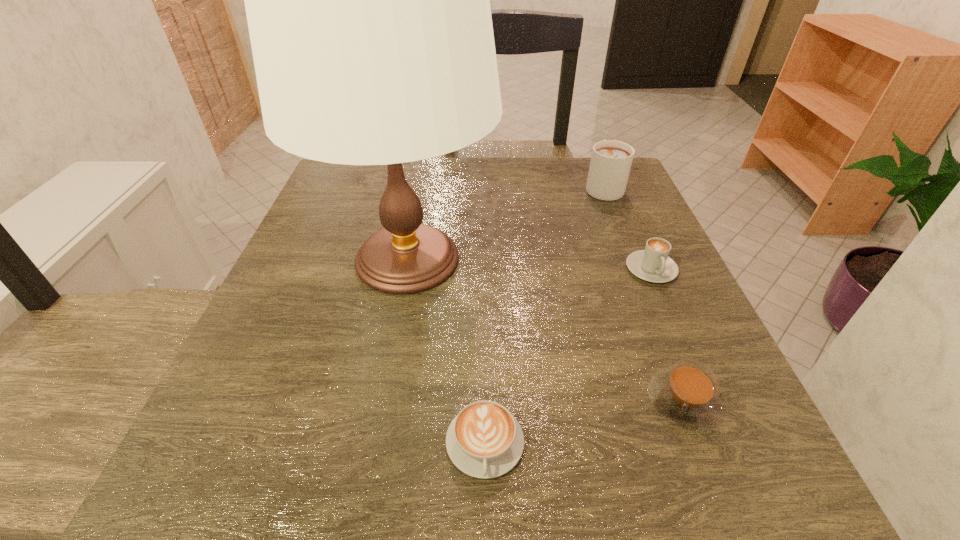
The height and width of the screenshot is (540, 960). In the image, there is a desktop. What are the coordinates of `vacant space at the far right corner` in the screenshot? It's located at (632, 184).

In the image, there is a desktop. Identify the location of free space at the near right corner. (676, 448).

You are a GUI agent. You are given a task and a screenshot of the screen. Output one action in this format:
    pyautogui.click(x=<x>, y=<y>)
    Task: Click on the vacant space in between the tallest object and the second farthest cappuccino
    This screenshot has width=960, height=540.
    Given the screenshot: What is the action you would take?
    pyautogui.click(x=529, y=264)

This screenshot has width=960, height=540. Find the location of `free space between the second farthest cappuccino and the shortest object`. free space between the second farthest cappuccino and the shortest object is located at coordinates (568, 356).

The height and width of the screenshot is (540, 960). Identify the location of free point between the fourth shortest object and the tallest object. (505, 223).

You are a GUI agent. You are given a task and a screenshot of the screen. Output one action in this format:
    pyautogui.click(x=<x>, y=<y>)
    Task: Click on the vacant area that lies between the shortest object and the farthest object
    This screenshot has height=540, width=960.
    Given the screenshot: What is the action you would take?
    pyautogui.click(x=544, y=315)

Where is `the third closest object to the lamp`? The width and height of the screenshot is (960, 540). the third closest object to the lamp is located at coordinates (686, 395).

Identify the location of object that is the nearest to the third nearest cappuccino. Image resolution: width=960 pixels, height=540 pixels. (686, 395).

Find the location of a particular element. The image size is (960, 540). cappuccino that can be found as the third closest to the third nearest cappuccino is located at coordinates (484, 440).

You are a GUI agent. You are given a task and a screenshot of the screen. Output one action in this format:
    pyautogui.click(x=<x>, y=<y>)
    Task: Click on the cappuccino that stands as the second closest to the leftmost cappuccino
    This screenshot has height=540, width=960.
    Given the screenshot: What is the action you would take?
    pyautogui.click(x=653, y=264)